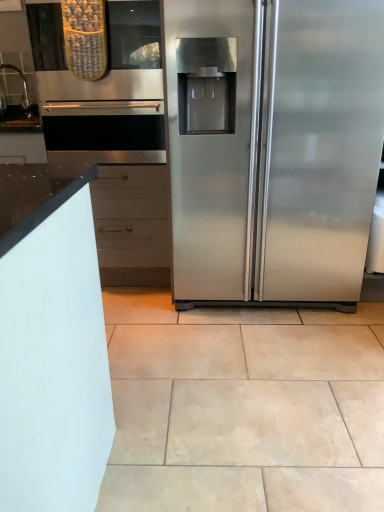
Question: Visually, is stainless steel refrigerator at right positioned to the left or to the right of beige ceramic tile at center?

Choices:
 (A) right
 (B) left

Answer: (A)

Question: Considering the positions of stainless steel refrigerator at right and beige ceramic tile at center in the image, is stainless steel refrigerator at right taller or shorter than beige ceramic tile at center?

Choices:
 (A) tall
 (B) short

Answer: (A)

Question: Which object is the farthest from the beige ceramic tile at center?

Choices:
 (A) stainless steel refrigerator at right
 (B) satin nickel faucet at left

Answer: (B)

Question: Considering the real-world distances, which object is farthest from the beige ceramic tile at center?

Choices:
 (A) stainless steel refrigerator at right
 (B) satin nickel faucet at left

Answer: (B)